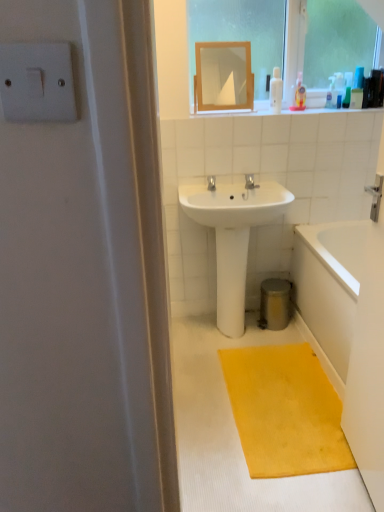
Question: Is wooden frame mirror at upper center looking in the opposite direction of translucent plastic soap dispenser at upper right, the second toiletry in the right-to-left sequence?

Choices:
 (A) no
 (B) yes

Answer: (A)

Question: Is wooden frame mirror at upper center positioned behind translucent plastic soap dispenser at upper right, the second toiletry in the right-to-left sequence?

Choices:
 (A) no
 (B) yes

Answer: (A)

Question: Is wooden frame mirror at upper center positioned beyond the bounds of translucent plastic soap dispenser at upper right, which appears as the second toiletry when viewed from the left?

Choices:
 (A) no
 (B) yes

Answer: (B)

Question: Is wooden frame mirror at upper center thinner than translucent plastic soap dispenser at upper right, which appears as the second toiletry when viewed from the left?

Choices:
 (A) yes
 (B) no

Answer: (B)

Question: Is wooden frame mirror at upper center wider than translucent plastic soap dispenser at upper right, which appears as the second toiletry when viewed from the left?

Choices:
 (A) no
 (B) yes

Answer: (B)

Question: Do you think transparent glass mirror at upper center is within yellow textured mat at lower right, or outside of it?

Choices:
 (A) outside
 (B) inside

Answer: (A)

Question: Is transparent glass mirror at upper center in front of or behind yellow textured mat at lower right in the image?

Choices:
 (A) behind
 (B) front

Answer: (A)

Question: Looking at the image, does transparent glass mirror at upper center seem bigger or smaller compared to yellow textured mat at lower right?

Choices:
 (A) small
 (B) big

Answer: (B)

Question: Visually, is transparent glass mirror at upper center positioned to the left or to the right of yellow textured mat at lower right?

Choices:
 (A) right
 (B) left

Answer: (A)

Question: Is transparent glass mirror at upper center taller or shorter than wooden frame mirror at upper center?

Choices:
 (A) short
 (B) tall

Answer: (B)

Question: From the image's perspective, is transparent glass mirror at upper center positioned above or below wooden frame mirror at upper center?

Choices:
 (A) below
 (B) above

Answer: (B)

Question: Considering the positions of point (218, 14) and point (218, 101), is point (218, 14) closer or farther from the camera than point (218, 101)?

Choices:
 (A) farther
 (B) closer

Answer: (B)

Question: Considering the positions of transparent glass mirror at upper center and wooden frame mirror at upper center in the image, is transparent glass mirror at upper center wider or thinner than wooden frame mirror at upper center?

Choices:
 (A) thin
 (B) wide

Answer: (B)

Question: From a real-world perspective, is white plastic light switch at upper left physically located above or below wooden frame mirror at upper center?

Choices:
 (A) above
 (B) below

Answer: (A)

Question: From the image's perspective, relative to wooden frame mirror at upper center, is white plastic light switch at upper left above or below?

Choices:
 (A) above
 (B) below

Answer: (B)